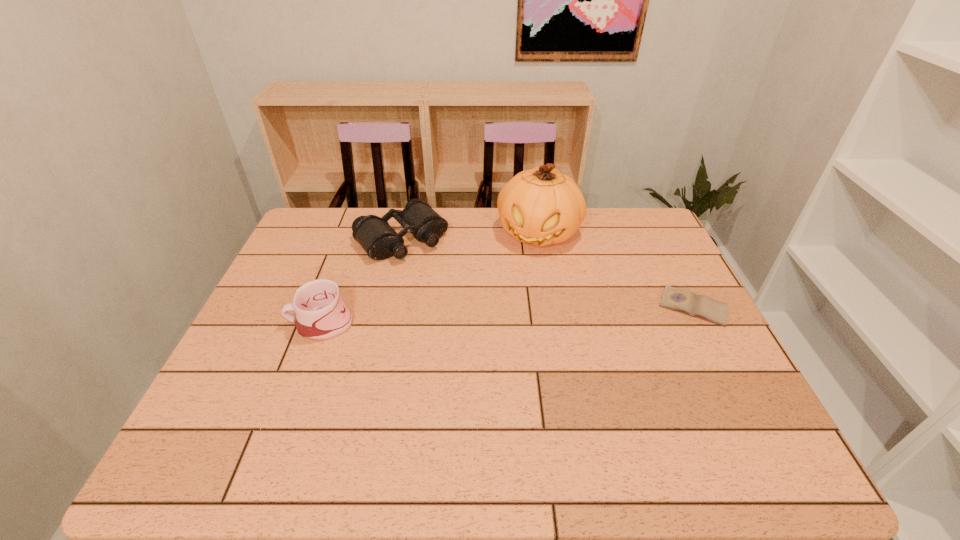
In the image, there is a desktop. Where is `vacant space at the right edge`? vacant space at the right edge is located at coordinates (693, 376).

Find the location of `free space at the far left corner`. free space at the far left corner is located at coordinates (336, 225).

The width and height of the screenshot is (960, 540). I want to click on vacant space at the far right corner of the desktop, so click(x=657, y=241).

I want to click on vacant space in between the tallest object and the mug, so click(x=429, y=278).

The width and height of the screenshot is (960, 540). I want to click on empty space that is in between the tallest object and the mug, so click(x=429, y=278).

This screenshot has width=960, height=540. Find the location of `vacant space that is in between the shortest object and the mug`. vacant space that is in between the shortest object and the mug is located at coordinates click(x=507, y=315).

Locate an element on the screen. Image resolution: width=960 pixels, height=540 pixels. vacant space that's between the binoculars and the third object from left to right is located at coordinates (469, 236).

The width and height of the screenshot is (960, 540). Identify the location of free space between the mug and the diary. (507, 315).

Image resolution: width=960 pixels, height=540 pixels. I want to click on vacant area that lies between the binoculars and the mug, so click(361, 281).

The image size is (960, 540). Identify the location of vacant region between the pumpkin and the mug. (429, 278).